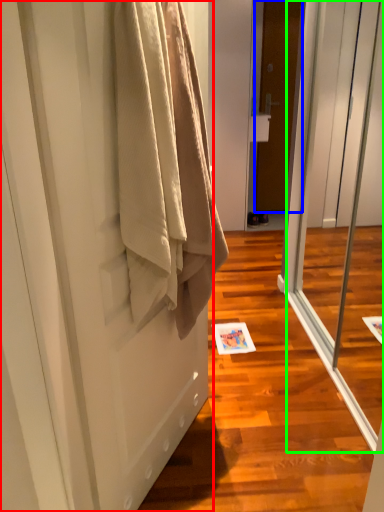
Question: Considering the real-world distances, which object is farthest from door (highlighted by a red box)? door (highlighted by a blue box) or screen door (highlighted by a green box)?

Choices:
 (A) door
 (B) screen door

Answer: (A)